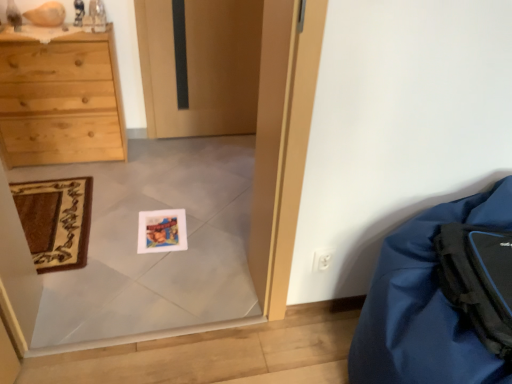
Identify the location of free space above carpeted mat at lower left (from a real-world perspective). (45, 209).